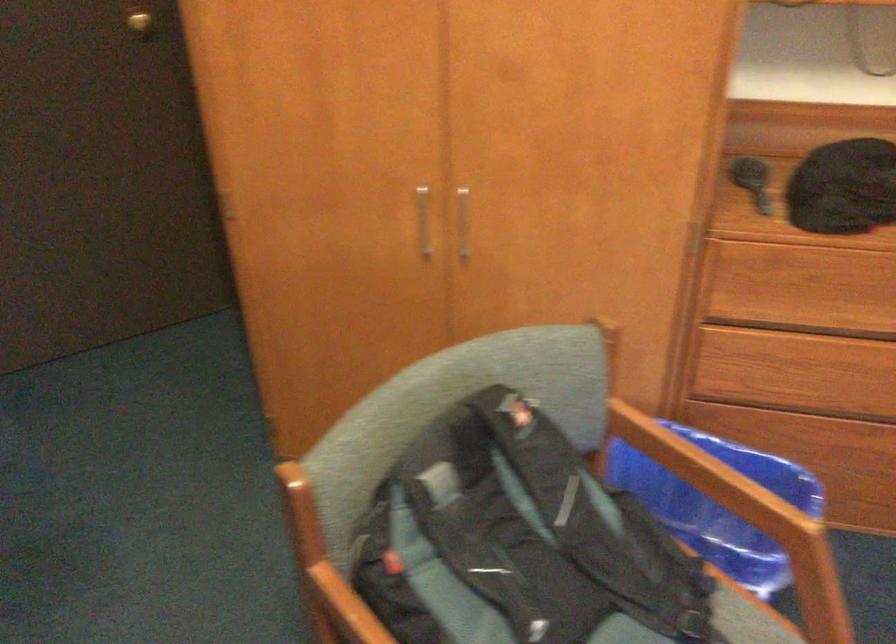
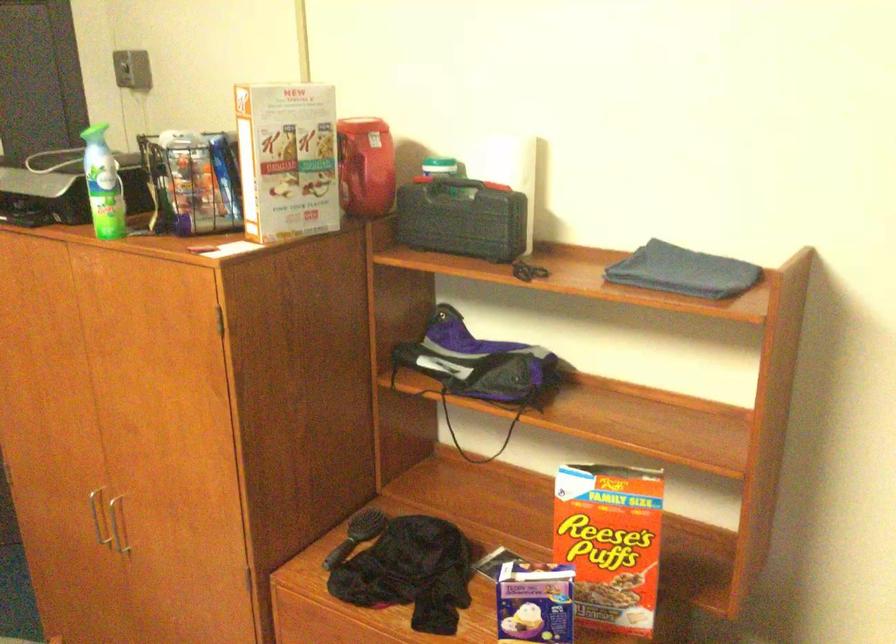
Question: In a continuous first-person perspective shot, in which direction is the camera moving?

Choices:
 (A) Left
 (B) Right
 (C) Forward
 (D) Backward

Answer: (B)